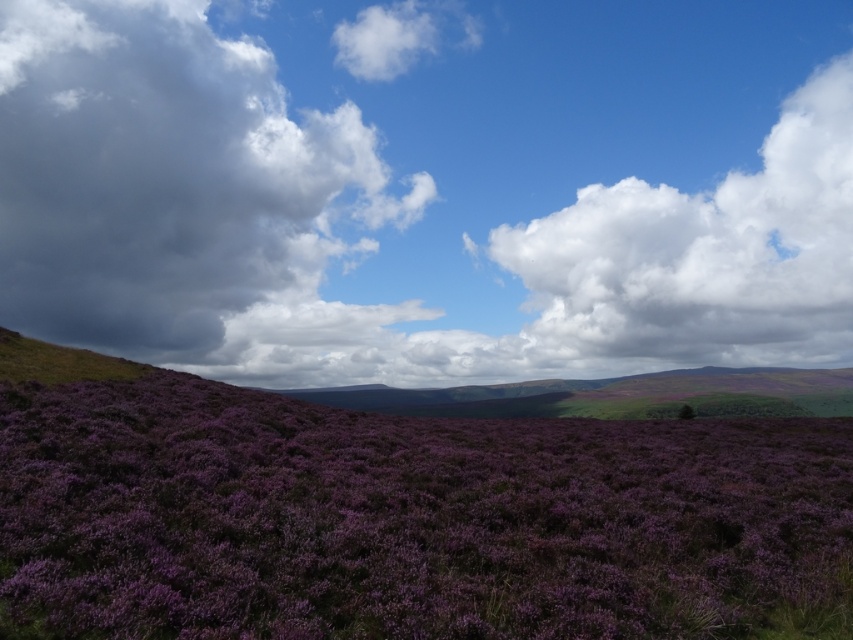
You are standing in the middle of the purple heather field in the foreground. Looking up, you see a specific point marked at coordinates (428,189). Based on the scene, what would you observe at that point?

The point at (428,189) corresponds to cloudy sky at upper center, so you would see cloudy sky there.

You are standing in the field of purple heather flowers and looking up at the cloudy sky at upper center and the white fluffy cloud at upper right. Which one is higher in the sky?

The cloudy sky at upper center is taller than the white fluffy cloud at upper right, so the cloudy sky at upper center is higher in the sky.